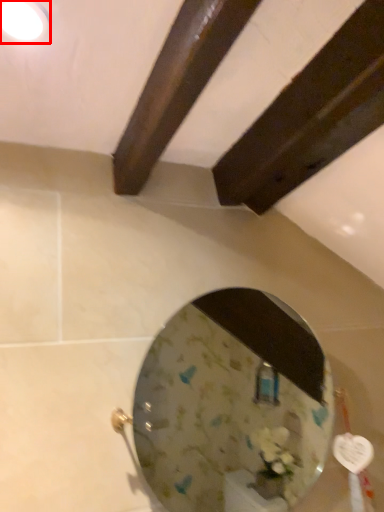
Question: Observing the image, what is the correct spatial positioning of light fixture (annotated by the red box) in reference to mirror?

Choices:
 (A) left
 (B) right

Answer: (A)